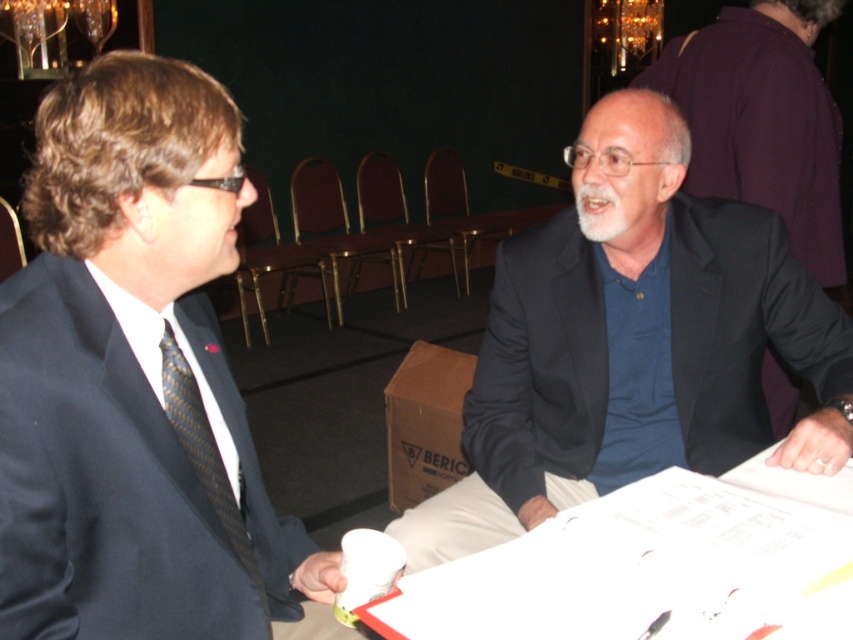
Which is above, matte black suit at left or dark blue suit at right?

dark blue suit at right is higher up.

How far apart are matte black suit at left and dark blue suit at right?

matte black suit at left is 24.80 inches from dark blue suit at right.

Is point (294, 522) positioned after point (778, 305)?

No, (294, 522) is closer to viewer.

Image resolution: width=853 pixels, height=640 pixels. Find the location of `matte black suit at left`. matte black suit at left is located at coordinates (135, 380).

Does dark blue suit at right appear over black striped tie at left?

Correct, dark blue suit at right is located above black striped tie at left.

How far apart are dark blue suit at right and black striped tie at left?

The distance of dark blue suit at right from black striped tie at left is 74.65 centimeters.

Where is `dark blue suit at right`? The image size is (853, 640). dark blue suit at right is located at coordinates (631, 342).

Find the location of `dark blue suit at right`. dark blue suit at right is located at coordinates (631, 342).

Is matte black suit at left shorter than white paper at center?

No, matte black suit at left is not shorter than white paper at center.

Does matte black suit at left appear under white paper at center?

Incorrect, matte black suit at left is not positioned below white paper at center.

Is point (231, 140) closer to camera compared to point (721, 636)?

No, it is behind (721, 636).

The image size is (853, 640). Identify the location of matte black suit at left. (135, 380).